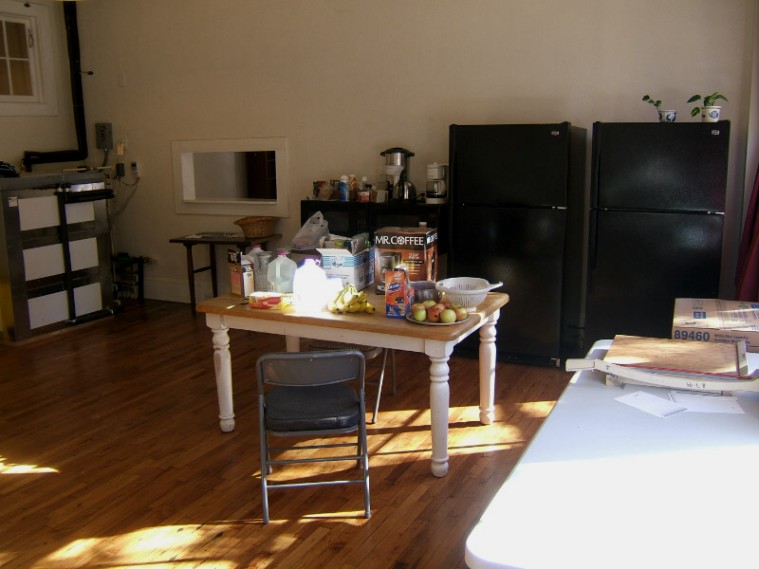
You are a GUI agent. You are given a task and a screenshot of the screen. Output one action in this format:
    pyautogui.click(x=<x>, y=<y>)
    Task: Click on the fridge
    This screenshot has width=759, height=569.
    Given the screenshot: What is the action you would take?
    pyautogui.click(x=674, y=164)